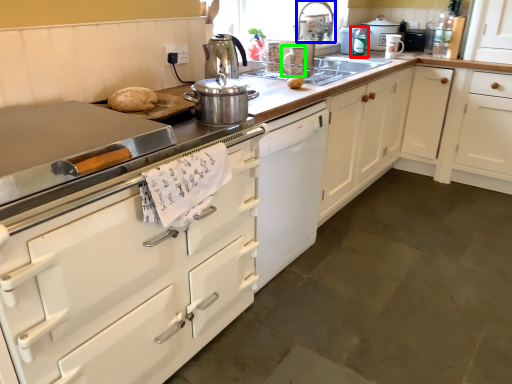
Question: Based on their relative distances, which object is nearer to kitchen appliance (highlighted by a red box)? Choose from faucet (highlighted by a blue box) and kitchen appliance (highlighted by a green box).

Choices:
 (A) faucet
 (B) kitchen appliance

Answer: (A)